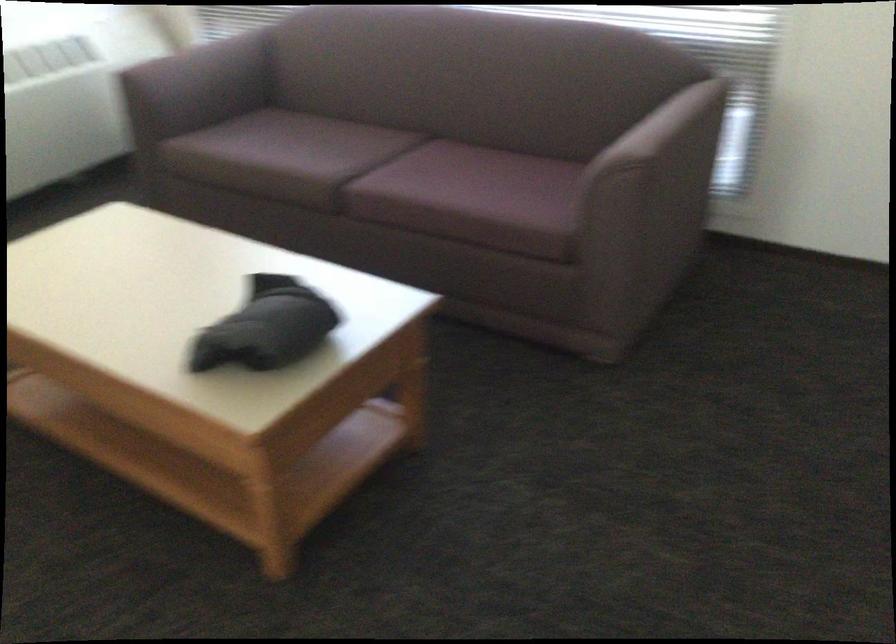
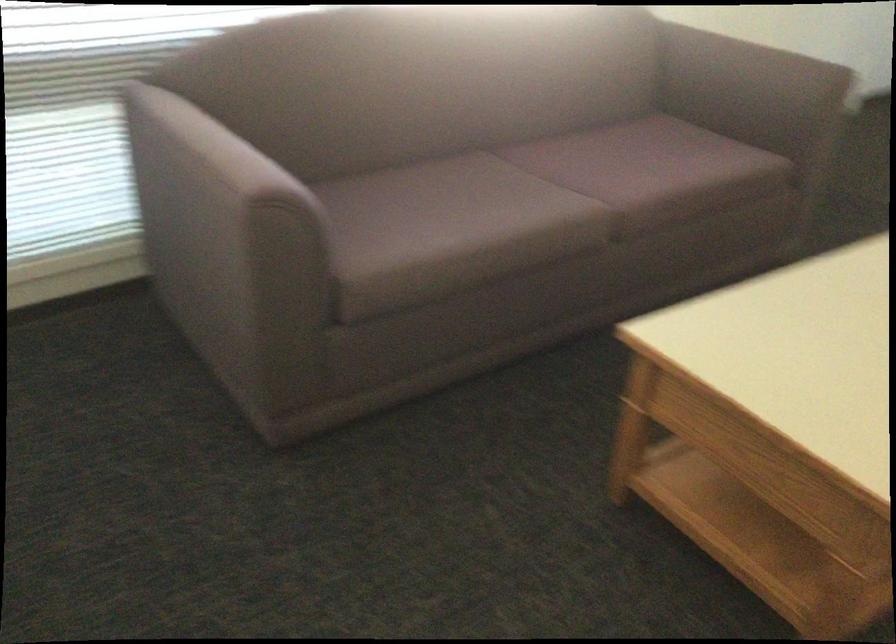
In the second image, find the point that corresponds to (x=296, y=158) in the first image.

(528, 205)